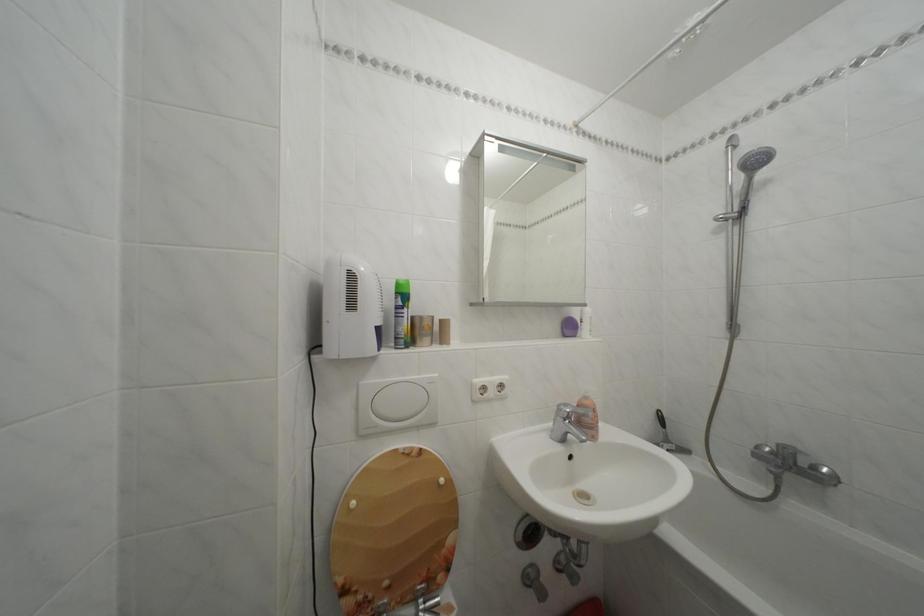
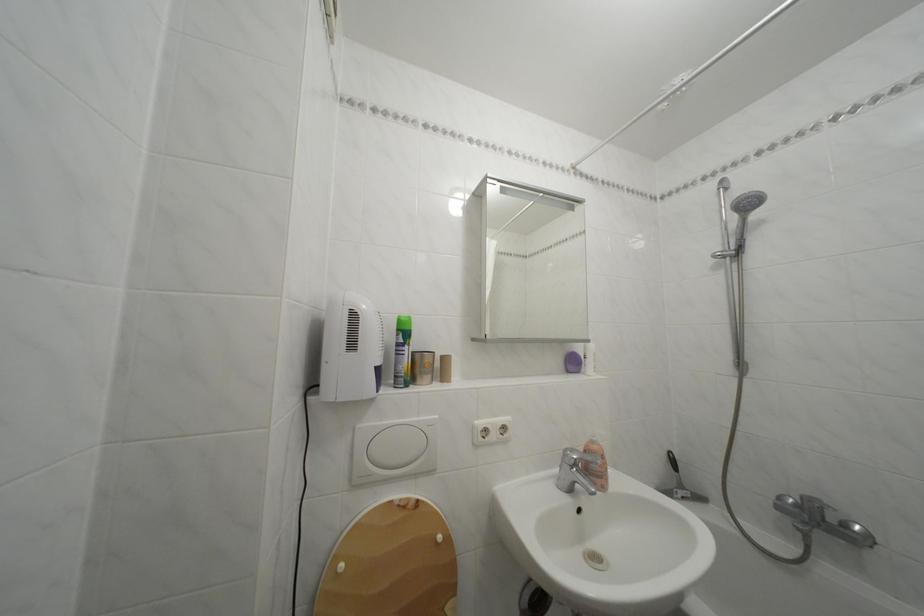
Locate, in the second image, the point that corresponds to the point at 371,389 in the first image.

(368, 432)